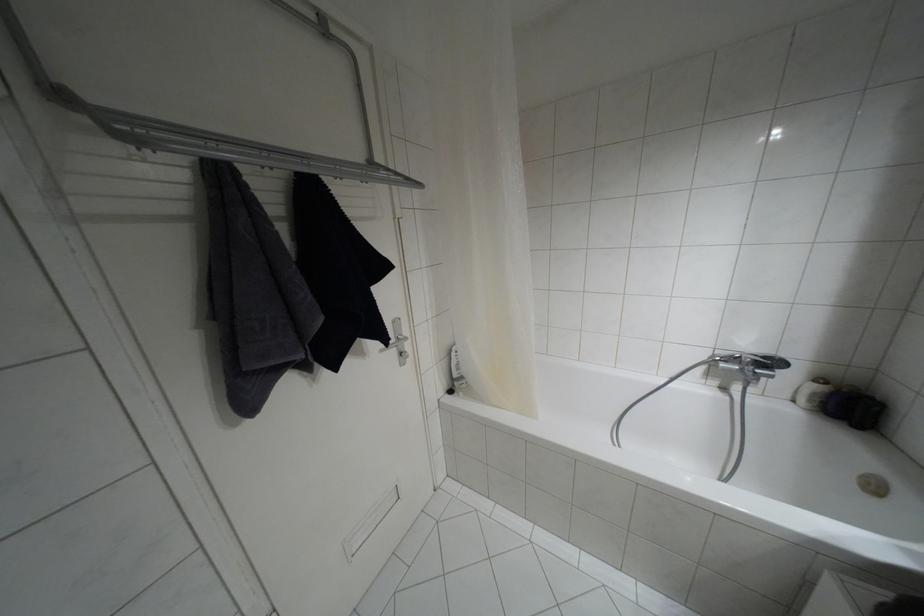
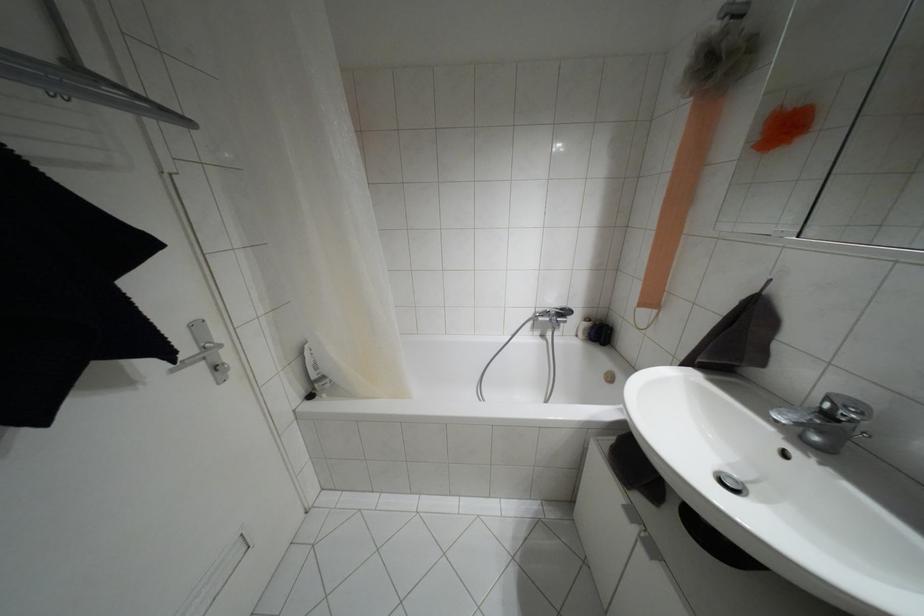
Question: The camera is either moving clockwise (left) or counter-clockwise (right) around the object. The first image is from the beginning of the video and the second image is from the end. Is the camera moving left or right when shooting the video?

Choices:
 (A) Left
 (B) Right

Answer: (A)